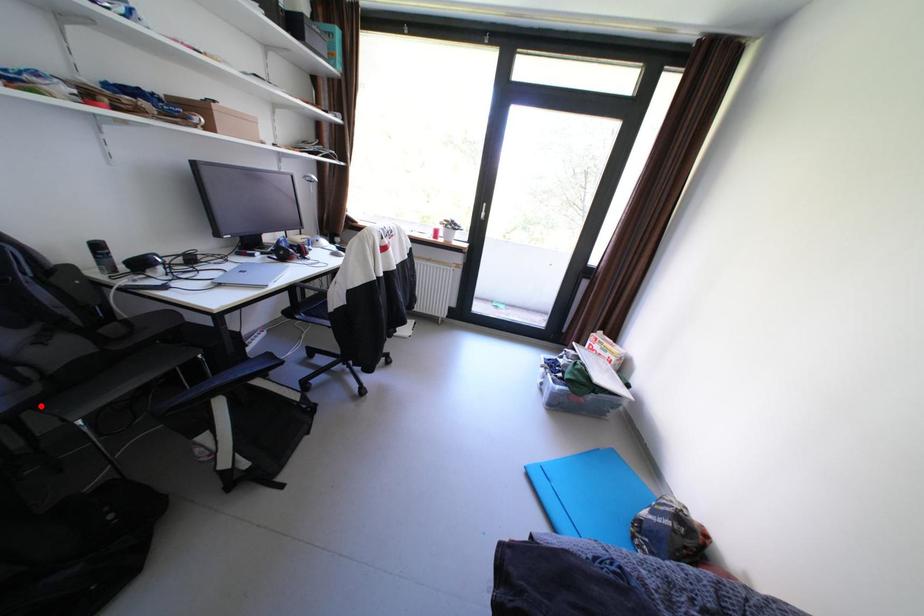
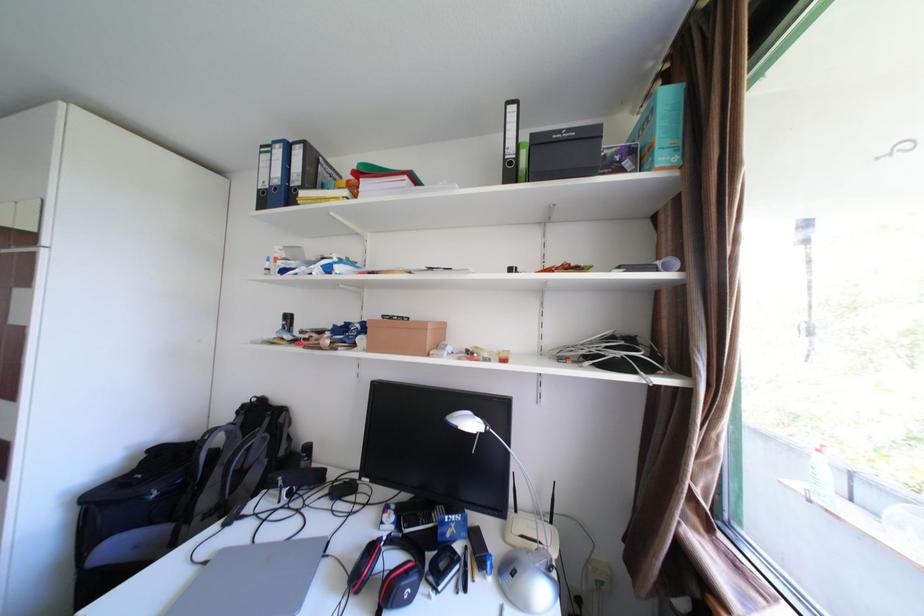
Question: I am providing you with two images of the same scene from different viewpoints. A red point is marked on the first image. At the location where the point appears in image 1, is it still visible in image 2?

Choices:
 (A) Yes
 (B) No

Answer: (B)